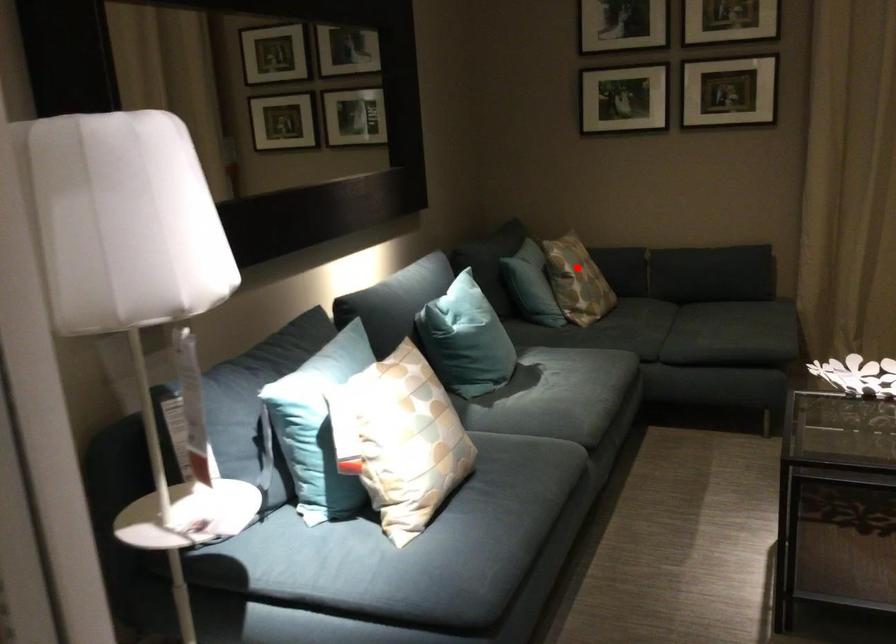
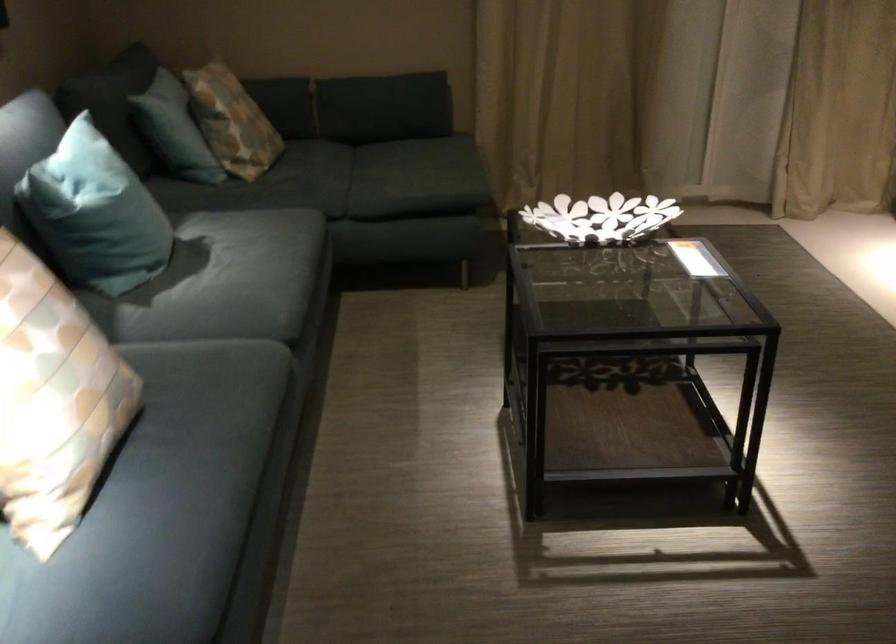
Question: I am providing you with two images of the same scene from different viewpoints. A red point is marked on the first image. At the location where the point appears in image 1, is it still visible in image 2?

Choices:
 (A) Yes
 (B) No

Answer: (A)